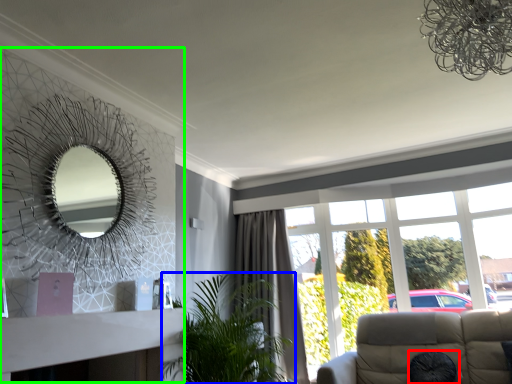
Question: Which is farther away from oval (highlighted by a red box)? houseplant (highlighted by a blue box) or fireplace (highlighted by a green box)?

Choices:
 (A) houseplant
 (B) fireplace

Answer: (B)